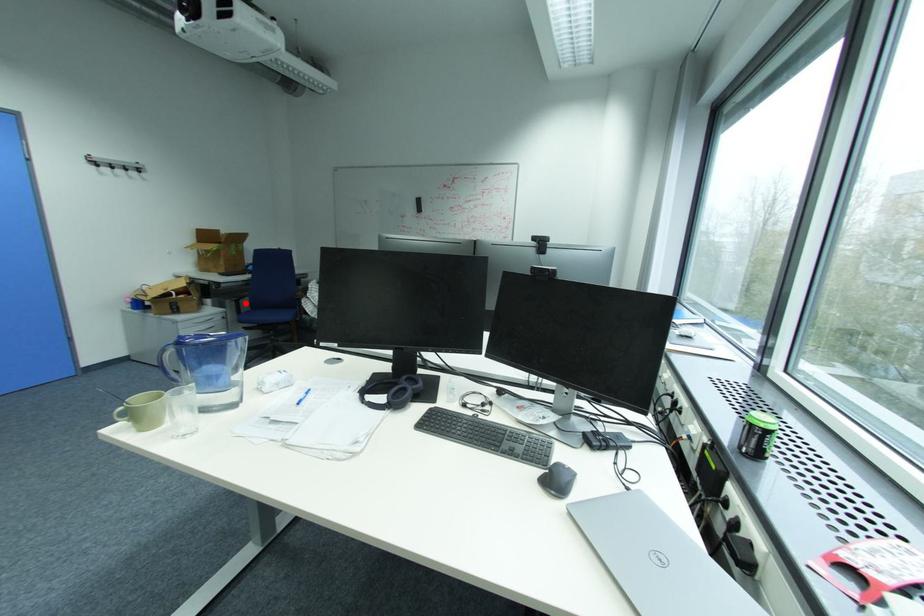
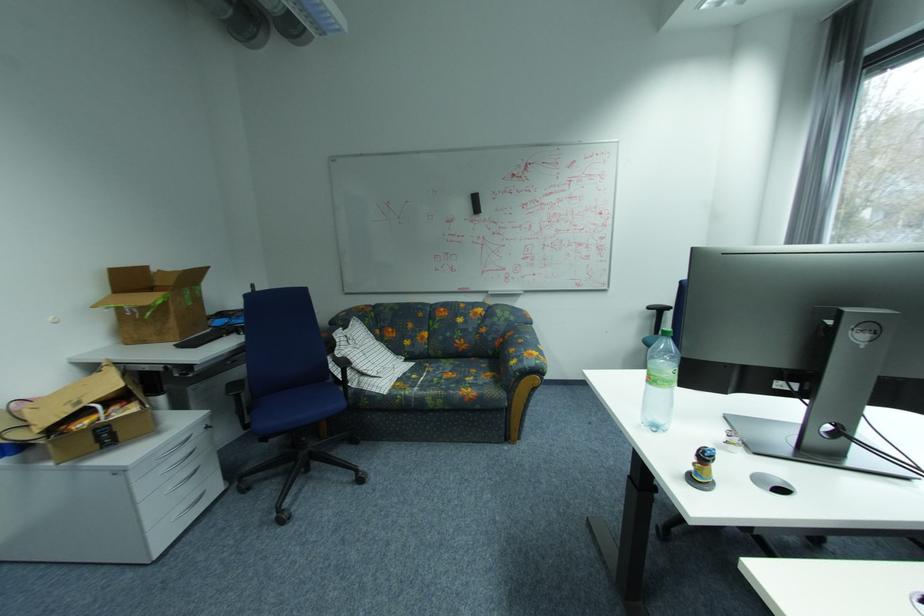
Question: A red point is marked in image1. In image2, is the corresponding 3D point closer to the camera or farther? Reply with the corresponding letter.

Choices:
 (A) The corresponding 3D point is closer.
 (B) The corresponding 3D point is farther.

Answer: (B)